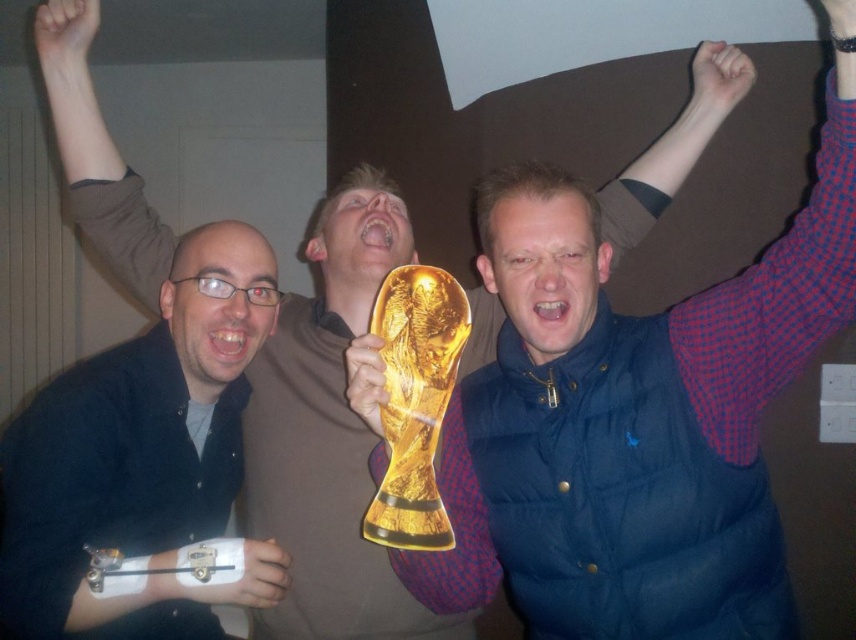
You are standing in the room where the celebration is happening. You need to hand a gift to the person wearing the blue puffer vest at center and the person wearing the matte black shirt at left. Which person should you approach first to give them their gift if you want to give the gifts starting from the closest to you?

You should give the gift to the blue puffer vest at center first because it is closer to the viewer than the matte black shirt at left.

You are organizing a charity clothing drive and need to determine which item takes up more space in the donation box. Based on the scene, which item between the blue puffer vest at center and the matte black shirt at left is bigger in size?

Answer: The blue puffer vest at center has a larger size compared to matte black shirt at left, so it takes up more space in the donation box.